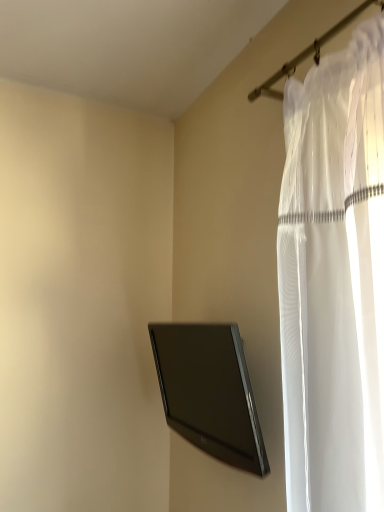
What do you see at coordinates (209, 391) in the screenshot? I see `matte black tv at center` at bounding box center [209, 391].

Where is `matte black tv at center`? matte black tv at center is located at coordinates (209, 391).

The width and height of the screenshot is (384, 512). Find the location of `matte black tv at center`. matte black tv at center is located at coordinates (209, 391).